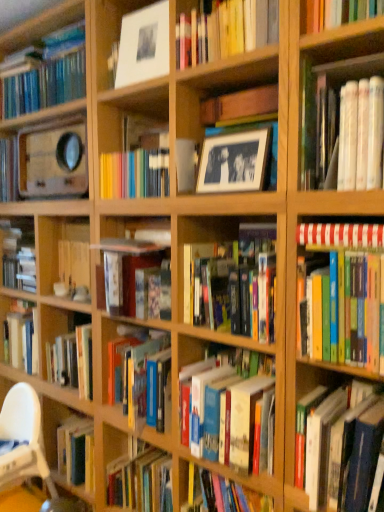
Identify the location of hardcover book at right, the 6th book in the top-to-bottom sequence. The width and height of the screenshot is (384, 512). (344, 448).

Locate an element on the screen. The image size is (384, 512). white plastic chair at lower left is located at coordinates (23, 440).

Where is `matte black frame at center, which is counted as the 1th shelf, starting from the right`? matte black frame at center, which is counted as the 1th shelf, starting from the right is located at coordinates [226, 94].

What are the coordinates of `hardcover books at right, the fourth book when ordered from top to bottom` in the screenshot? It's located at (343, 294).

I want to click on hardcover book at center, the fifth book positioned from the top, so (227, 413).

Locate an element on the screen. The image size is (384, 512). white striped book at right, the 2th book in the top-to-bottom sequence is located at coordinates (340, 234).

Which of these two, white striped book at right, the 2th book in the top-to-bottom sequence, or hardcover book at center, which appears as the 2th book when ordered from the bottom, is bigger?

With larger size is hardcover book at center, which appears as the 2th book when ordered from the bottom.

Starting from the white striped book at right, the 2th book in the top-to-bottom sequence, which book is the 1st one behind? Please provide its 2D coordinates.

[(227, 413)]

From a real-world perspective, is white striped book at right, the 5th book positioned from the bottom, beneath hardcover book at center, the fifth book positioned from the top?

No, from a real-world perspective, white striped book at right, the 5th book positioned from the bottom, is not below hardcover book at center, the fifth book positioned from the top.

Can you confirm if white striped book at right, the 5th book positioned from the bottom, is positioned to the left of hardcover book at center, which appears as the 2th book when ordered from the bottom?

No, white striped book at right, the 5th book positioned from the bottom, is not to the left of hardcover book at center, which appears as the 2th book when ordered from the bottom.

Considering the relative sizes of hardcover book at right, placed as the first book when sorted from bottom to top, and black matte picture frame at upper center in the image provided, is hardcover book at right, placed as the first book when sorted from bottom to top, bigger than black matte picture frame at upper center?

Correct, hardcover book at right, placed as the first book when sorted from bottom to top, is larger in size than black matte picture frame at upper center.

What's the angular difference between hardcover book at right, the 6th book in the top-to-bottom sequence, and black matte picture frame at upper center's facing directions?

The angular difference between hardcover book at right, the 6th book in the top-to-bottom sequence, and black matte picture frame at upper center is 0.00316 degrees.

Is hardcover book at right, placed as the first book when sorted from bottom to top, closer to the viewer compared to black matte picture frame at upper center?

Yes, hardcover book at right, placed as the first book when sorted from bottom to top, is closer to the camera.

Is hardcover book at right, the 6th book in the top-to-bottom sequence, shorter than black matte picture frame at upper center?

Answer: No.

Which is behind, point (128, 32) or point (204, 367)?

The point (128, 32) is farther from the camera.

Based on the photo, from the image's perspective, relative to hardcover book at center, which appears as the 2th book when ordered from the bottom, is matte white frame at upper center, the 2th shelf when ordered from right to left, above or below?

matte white frame at upper center, the 2th shelf when ordered from right to left, is situated higher than hardcover book at center, which appears as the 2th book when ordered from the bottom, in the image.

From a real-world perspective, is matte white frame at upper center, placed as the first shelf when sorted from left to right, under hardcover book at center, the fifth book positioned from the top?

No, from a real-world perspective, matte white frame at upper center, placed as the first shelf when sorted from left to right, is not under hardcover book at center, the fifth book positioned from the top.

From the picture: Can you confirm if hardcover book at center, the fourth book when ordered from bottom to top, is shorter than hardcover book at right, the 6th book in the top-to-bottom sequence?

Yes.

Considering the relative positions of hardcover book at center, placed as the third book when sorted from top to bottom, and hardcover book at right, the 6th book in the top-to-bottom sequence, in the image provided, is hardcover book at center, placed as the third book when sorted from top to bottom, to the left of hardcover book at right, the 6th book in the top-to-bottom sequence, from the viewer's perspective?

Correct, you'll find hardcover book at center, placed as the third book when sorted from top to bottom, to the left of hardcover book at right, the 6th book in the top-to-bottom sequence.

Considering the positions of points (184, 313) and (382, 397), is point (184, 313) closer to camera compared to point (382, 397)?

No, it is behind (382, 397).

Looking at this image, between hardcover book at center, placed as the third book when sorted from top to bottom, and hardcover book at right, placed as the first book when sorted from bottom to top, which one has smaller size?

With smaller size is hardcover book at right, placed as the first book when sorted from bottom to top.

Which is less distant, (x=342, y=125) or (x=338, y=277)?

The point (x=342, y=125) is more forward.

Is white paper book at upper right, acting as the 1th book starting from the top, not inside hardcover books at right, marked as the 3th book in a bottom-to-top arrangement?

Absolutely, white paper book at upper right, acting as the 1th book starting from the top, is external to hardcover books at right, marked as the 3th book in a bottom-to-top arrangement.

What's the angular difference between white paper book at upper right, acting as the 1th book starting from the top, and hardcover books at right, marked as the 3th book in a bottom-to-top arrangement,'s facing directions?

0.00034 degrees separate the facing orientations of white paper book at upper right, acting as the 1th book starting from the top, and hardcover books at right, marked as the 3th book in a bottom-to-top arrangement.

Locate an element on the screen. The height and width of the screenshot is (512, 384). shelf lying on the left of matte black frame at center, the second shelf positioned from the left is located at coordinates (142, 46).

Are matte black frame at center, the second shelf positioned from the left, and matte white frame at upper center, placed as the first shelf when sorted from left to right, far apart?

No, there isn't a large distance between matte black frame at center, the second shelf positioned from the left, and matte white frame at upper center, placed as the first shelf when sorted from left to right.

Which object is more forward, matte black frame at center, the second shelf in the top-to-bottom sequence, or matte white frame at upper center, placed as the first shelf when sorted from left to right?

matte black frame at center, the second shelf in the top-to-bottom sequence, is more forward.

Which object is closer to the camera taking this photo, hardcover book at right, the 6th book in the top-to-bottom sequence, or hardcover books at right, the fourth book when ordered from top to bottom?

hardcover books at right, the fourth book when ordered from top to bottom, is closer to the camera.

From a real-world perspective, between hardcover book at right, the 6th book in the top-to-bottom sequence, and hardcover books at right, the fourth book when ordered from top to bottom, who is vertically lower?

In real-world perspective, hardcover book at right, the 6th book in the top-to-bottom sequence, is lower.

Is hardcover book at right, placed as the first book when sorted from bottom to top, oriented away from hardcover books at right, marked as the 3th book in a bottom-to-top arrangement?

No, hardcover book at right, placed as the first book when sorted from bottom to top,'s orientation is not away from hardcover books at right, marked as the 3th book in a bottom-to-top arrangement.

This screenshot has width=384, height=512. Find the location of `the 1st book in front of the hardcover book at center, the fifth book positioned from the top, counting from the anchor's position`. the 1st book in front of the hardcover book at center, the fifth book positioned from the top, counting from the anchor's position is located at coordinates (340, 234).

Where is `book that is the 5th one when counting downward from the black matte picture frame at upper center (from the image's perspective)`? book that is the 5th one when counting downward from the black matte picture frame at upper center (from the image's perspective) is located at coordinates (344, 448).

In the scene shown: Considering their positions, is matte white frame at upper center, the 2th shelf when ordered from right to left, positioned closer to white paper book at upper right, acting as the 1th book starting from the top, than white striped book at right, the 2th book in the top-to-bottom sequence?

white striped book at right, the 2th book in the top-to-bottom sequence, lies closer to white paper book at upper right, acting as the 1th book starting from the top, than the other object.

Based on the photo, based on their spatial positions, is white plastic chair at lower left or hardcover book at center, which appears as the 2th book when ordered from the bottom, closer to black matte picture frame at upper center?

hardcover book at center, which appears as the 2th book when ordered from the bottom, lies closer to black matte picture frame at upper center than the other object.

When comparing their distances from hardcover book at right, placed as the first book when sorted from bottom to top, does hardcover books at right, marked as the 3th book in a bottom-to-top arrangement, or black matte picture frame at upper center seem further?

The object further to hardcover book at right, placed as the first book when sorted from bottom to top, is black matte picture frame at upper center.

When comparing their distances from white paper book at upper right, arranged as the sixth book when ordered from the bottom, does matte white frame at upper center, placed as the first shelf when sorted from left to right, or black matte picture frame at upper center seem closer?

black matte picture frame at upper center.

Looking at the image, which one is located closer to white plastic chair at lower left, black matte picture frame at upper center or matte black frame at center, which is counted as the 1th shelf, starting from the bottom?

black matte picture frame at upper center.

From the image, which object appears to be farther from hardcover books at right, marked as the 3th book in a bottom-to-top arrangement, matte black frame at center, which is counted as the 1th shelf, starting from the right, or white striped book at right, the 5th book positioned from the bottom?

Among the two, matte black frame at center, which is counted as the 1th shelf, starting from the right, is located further to hardcover books at right, marked as the 3th book in a bottom-to-top arrangement.

Considering their positions, is hardcover book at center, the fourth book when ordered from bottom to top, positioned further to hardcover book at right, placed as the first book when sorted from bottom to top, than white striped book at right, the 2th book in the top-to-bottom sequence?

Among the two, white striped book at right, the 2th book in the top-to-bottom sequence, is located further to hardcover book at right, placed as the first book when sorted from bottom to top.

Based on their spatial positions, is matte black frame at center, which is counted as the 1th shelf, starting from the bottom, or white striped book at right, the 5th book positioned from the bottom, closer to hardcover book at center, the fifth book positioned from the top?

The object closer to hardcover book at center, the fifth book positioned from the top, is white striped book at right, the 5th book positioned from the bottom.

You are a GUI agent. You are given a task and a screenshot of the screen. Output one action in this format:
    pyautogui.click(x=<x>, y=<y>)
    Task: Click on the book between matte black frame at center, the second shelf positioned from the left, and white striped book at right, the 5th book positioned from the bottom, vertically
    
    Given the screenshot: What is the action you would take?
    pyautogui.click(x=342, y=125)

Locate an element on the screen. The height and width of the screenshot is (512, 384). picture frame between matte black frame at center, which is counted as the 1th shelf, starting from the bottom, and hardcover book at right, the 6th book in the top-to-bottom sequence, in the vertical direction is located at coordinates (238, 159).

You are a GUI agent. You are given a task and a screenshot of the screen. Output one action in this format:
    pyautogui.click(x=<x>, y=<y>)
    Task: Click on the shelf that lies between matte white frame at upper center, arranged as the 1th shelf when viewed from the top, and hardcover book at center, the fifth book positioned from the top, from top to bottom
    
    Given the screenshot: What is the action you would take?
    pyautogui.click(x=226, y=94)

You are a GUI agent. You are given a task and a screenshot of the screen. Output one action in this format:
    pyautogui.click(x=<x>, y=<y>)
    Task: Click on the picture frame between white paper book at upper right, arranged as the sixth book when ordered from the bottom, and hardcover book at right, the 6th book in the top-to-bottom sequence, from top to bottom
    The width and height of the screenshot is (384, 512).
    Given the screenshot: What is the action you would take?
    pyautogui.click(x=238, y=159)